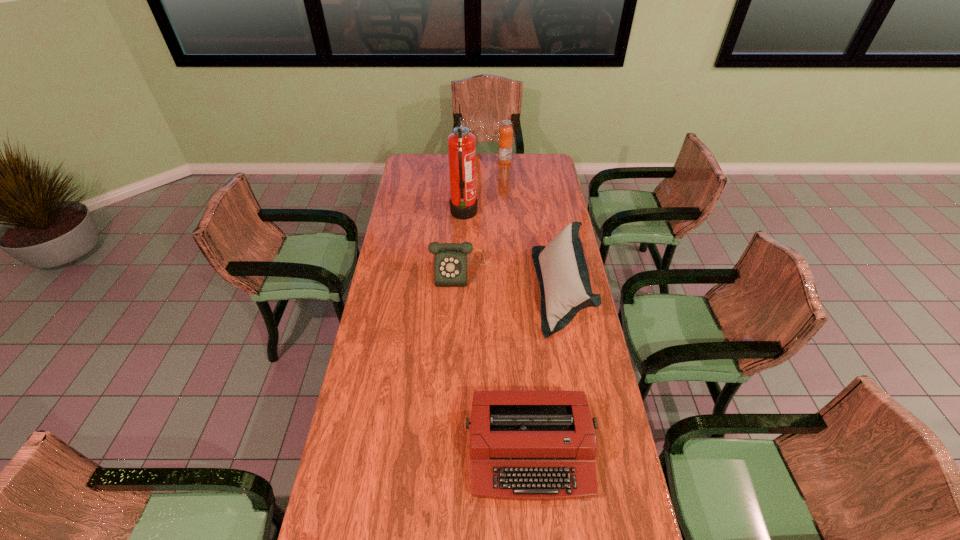
The height and width of the screenshot is (540, 960). In order to click on fire extinguisher in this screenshot , I will do `click(463, 203)`.

At what (x,y) coordinates should I click in order to perform the action: click on the tallest object. Please return your answer as a coordinate pair (x, y). This screenshot has height=540, width=960. Looking at the image, I should click on (463, 203).

Identify the location of the fourth shortest object. (505, 142).

Where is `fruit juice`? The image size is (960, 540). fruit juice is located at coordinates (505, 142).

Find the location of `cushion`. cushion is located at coordinates (561, 268).

At what (x,y) coordinates should I click in order to perform the action: click on telephone. Please return your answer as a coordinate pair (x, y). This screenshot has width=960, height=540. Looking at the image, I should click on (450, 270).

Where is `the nearest object`? The width and height of the screenshot is (960, 540). the nearest object is located at coordinates (524, 444).

Image resolution: width=960 pixels, height=540 pixels. I want to click on blank space located on the front-facing side of the tallest object, so click(x=498, y=214).

The image size is (960, 540). I want to click on free location located on the front of the farthest object, so click(x=506, y=178).

The width and height of the screenshot is (960, 540). I want to click on free spot located on the surface of the cushion, so click(516, 291).